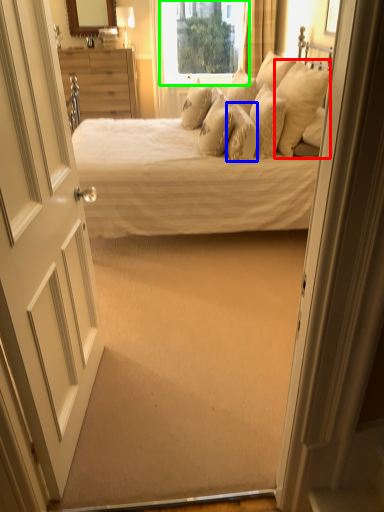
Question: Based on their relative distances, which object is nearer to pillow (highlighted by a red box)? Choose from pillow (highlighted by a blue box) and window (highlighted by a green box).

Choices:
 (A) pillow
 (B) window

Answer: (A)